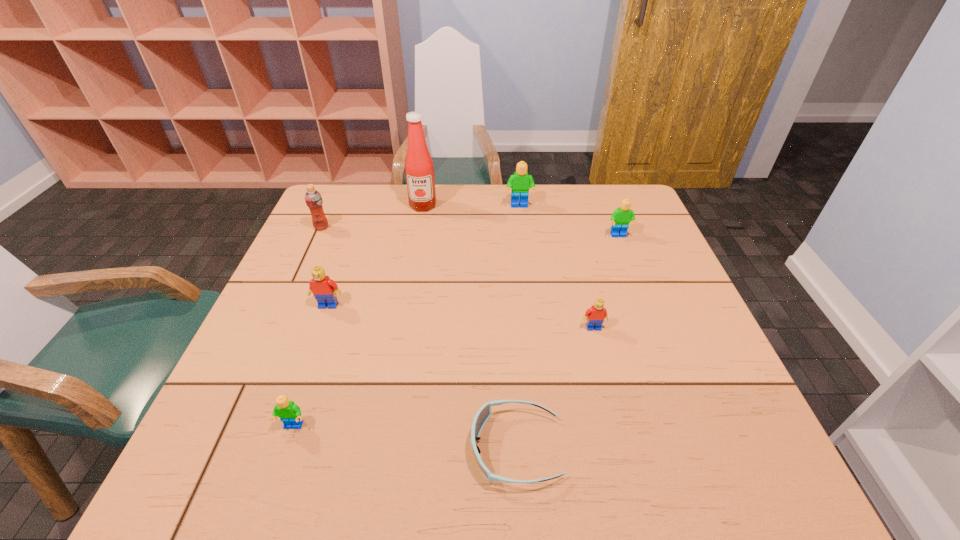
At what (x,y) coordinates should I click in order to perform the action: click on free space that is in between the farther red Lego and the shortest object. Please return your answer as a coordinate pair (x, y). Looking at the image, I should click on (422, 376).

Where is `blank region between the bigger red Lego and the condiment`? blank region between the bigger red Lego and the condiment is located at coordinates click(375, 255).

The height and width of the screenshot is (540, 960). Identify the location of unoccupied position between the rightmost green Lego and the goggles. click(567, 342).

Find the location of `vacant area that lies between the left red Lego and the leftmost green Lego`. vacant area that lies between the left red Lego and the leftmost green Lego is located at coordinates (311, 366).

Identify the location of vacant area between the red condiment and the goggles. This screenshot has width=960, height=540. (469, 327).

Find the location of `vacant point located between the rightmost green Lego and the third Lego from right to left`. vacant point located between the rightmost green Lego and the third Lego from right to left is located at coordinates (569, 221).

Locate an element on the screen. vacant space that is in between the orange juice and the second smallest green Lego is located at coordinates click(470, 232).

Where is `object identified as the sixth closest to the second green Lego from left to right`? object identified as the sixth closest to the second green Lego from left to right is located at coordinates (483, 414).

You are a GUI agent. You are given a task and a screenshot of the screen. Output one action in this format:
    pyautogui.click(x=<x>, y=<y>)
    Task: Click on the fifth closest object to the orange juice
    This screenshot has width=960, height=540.
    Given the screenshot: What is the action you would take?
    pyautogui.click(x=483, y=414)

Choose which Lego is the fourth nearest neighbor to the rightmost Lego. Please provide its 2D coordinates. Your answer should be formatted as a tuple, i.e. [(x, y)], where the tuple contains the x and y coordinates of a point satisfying the conditions above.

[(290, 414)]